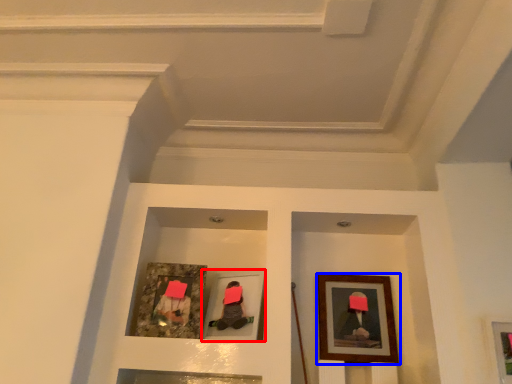
Question: Among these objects, which one is farthest to the camera, picture frame (highlighted by a red box) or picture frame (highlighted by a blue box)?

Choices:
 (A) picture frame
 (B) picture frame

Answer: (B)